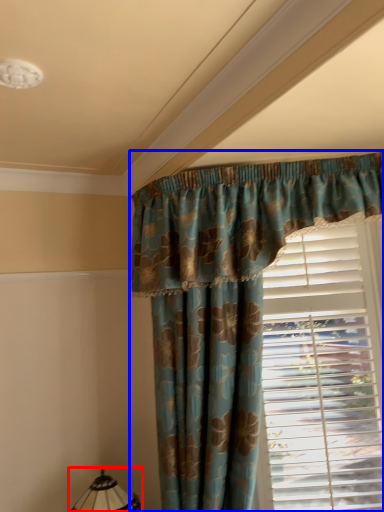
Question: Which of the following is the farthest to the observer, table lamp (highlighted by a red box) or curtain (highlighted by a blue box)?

Choices:
 (A) table lamp
 (B) curtain

Answer: (A)